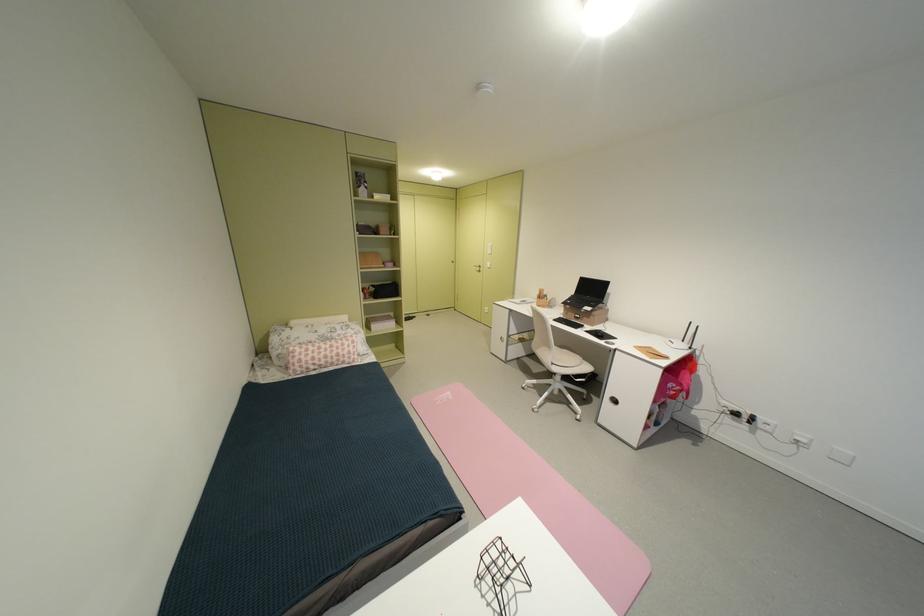
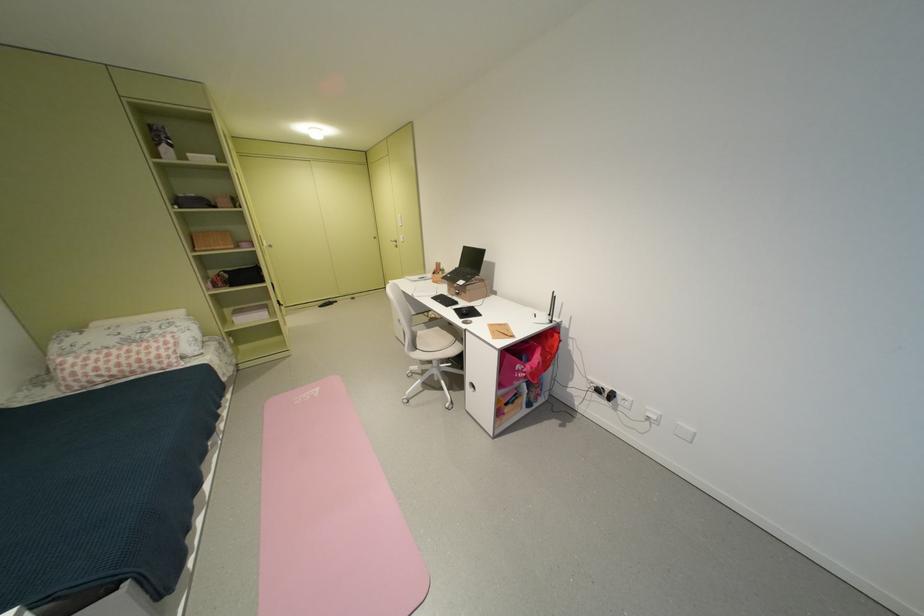
Locate, in the second image, the point that corresponds to [463,262] in the first image.

(383, 238)